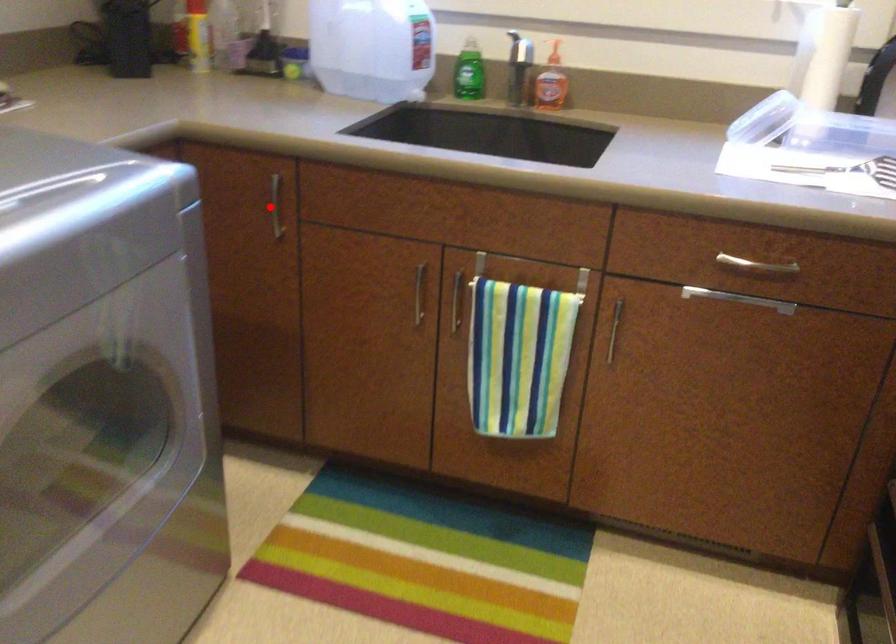
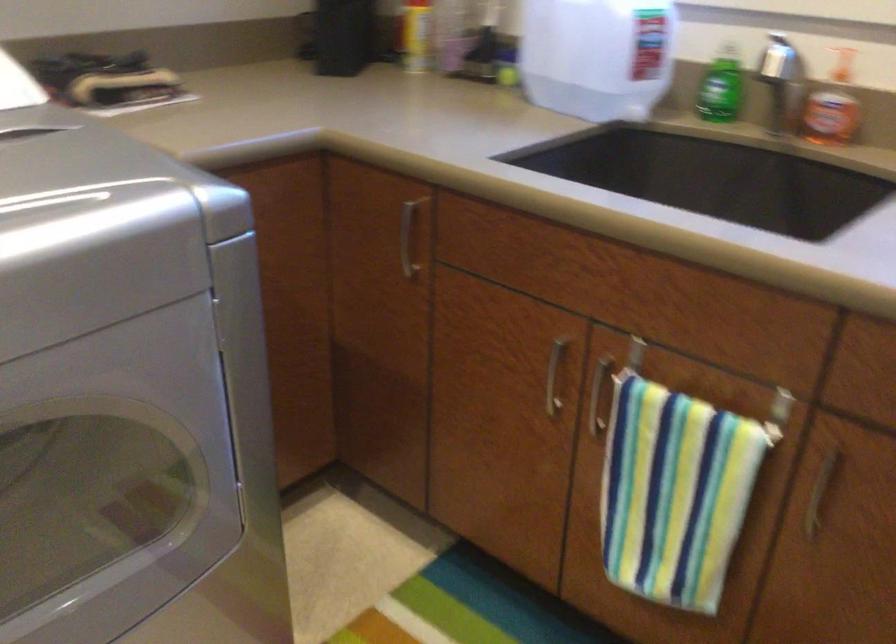
Question: I am providing you with two images of the same scene from different viewpoints. A red point is marked on the first image. Can you still see the location of the red point in image 2?

Choices:
 (A) Yes
 (B) No

Answer: (A)